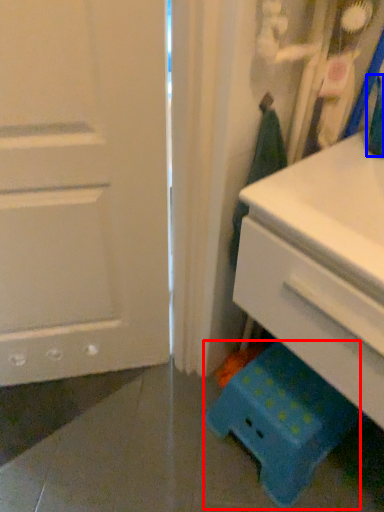
Question: Which of the following is the farthest to the observer, step stool (highlighted by a red box) or teal (highlighted by a blue box)?

Choices:
 (A) step stool
 (B) teal

Answer: (A)